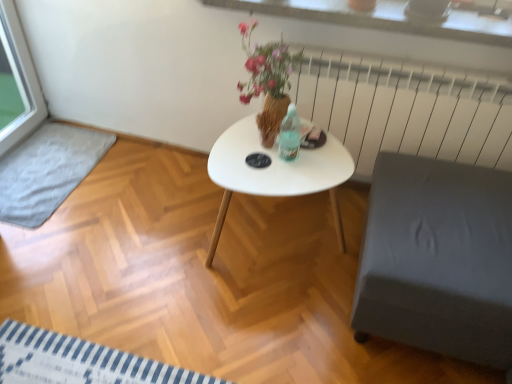
Question: From a real-world perspective, is gray fabric mat at lower left physically located above or below white matte coffee table at center?

Choices:
 (A) below
 (B) above

Answer: (A)

Question: Considering their positions, is gray fabric mat at lower left located in front of or behind white matte coffee table at center?

Choices:
 (A) behind
 (B) front

Answer: (A)

Question: Considering the real-world distances, which object is closest to the gray fabric ottoman at lower right?

Choices:
 (A) gray fabric mat at lower left
 (B) white matte coffee table at center
 (C) white glossy table at center
 (D) white metal radiator at upper right
 (E) white textured stone at upper center

Answer: (B)

Question: Estimate the real-world distances between objects in this image. Which object is farther from the gray fabric mat at lower left?

Choices:
 (A) gray fabric ottoman at lower right
 (B) white textured stone at upper center
 (C) white metal radiator at upper right
 (D) white glossy table at center
 (E) white matte coffee table at center

Answer: (A)